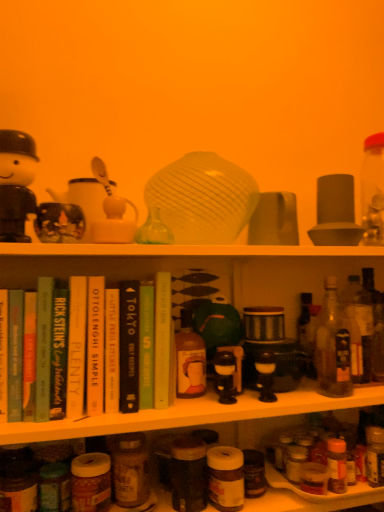
Question: Does translucent glass bottle at right, the third bottle in the left-to-right sequence, contain hardcover book at center, which is the 1th book in right-to-left order?

Choices:
 (A) yes
 (B) no

Answer: (B)

Question: Considering the relative positions of translucent glass bottle at right, the third bottle in the left-to-right sequence, and hardcover book at center, which is the 1th book in right-to-left order, in the image provided, is translucent glass bottle at right, the third bottle in the left-to-right sequence, behind hardcover book at center, which is the 1th book in right-to-left order,?

Choices:
 (A) yes
 (B) no

Answer: (A)

Question: From a real-world perspective, does translucent glass bottle at right, which is counted as the third bottle, starting from the right, stand above hardcover book at center, which is the 1th book in right-to-left order?

Choices:
 (A) no
 (B) yes

Answer: (A)

Question: Considering the relative sizes of translucent glass bottle at right, which is counted as the third bottle, starting from the right, and hardcover book at center, which is the 1th book in right-to-left order, in the image provided, is translucent glass bottle at right, which is counted as the third bottle, starting from the right, taller than hardcover book at center, which is the 1th book in right-to-left order,?

Choices:
 (A) yes
 (B) no

Answer: (A)

Question: Is the depth of translucent glass bottle at right, the third bottle in the left-to-right sequence, less than that of hardcover book at center, which is the 1th book in right-to-left order?

Choices:
 (A) yes
 (B) no

Answer: (B)

Question: From the image's perspective, would you say translucent glass bottle at right, the third bottle in the left-to-right sequence, is positioned over hardcover book at center, which is the 1th book in right-to-left order?

Choices:
 (A) no
 (B) yes

Answer: (A)

Question: From the image's perspective, does green matte book at center, which appears as the 2th book when viewed from the right, appear higher than hardcover book at center, placed as the 2th book when sorted from left to right?

Choices:
 (A) no
 (B) yes

Answer: (A)

Question: Considering the relative sizes of green matte book at center, which appears as the 2th book when viewed from the right, and hardcover book at center, acting as the 4th book starting from the right, in the image provided, is green matte book at center, which appears as the 2th book when viewed from the right, wider than hardcover book at center, acting as the 4th book starting from the right,?

Choices:
 (A) no
 (B) yes

Answer: (B)

Question: Is green matte book at center, which appears as the 2th book when viewed from the right, touching hardcover book at center, acting as the 4th book starting from the right?

Choices:
 (A) yes
 (B) no

Answer: (A)

Question: From a real-world perspective, does green matte book at center, which appears as the 2th book when viewed from the right, sit lower than hardcover book at center, placed as the 2th book when sorted from left to right?

Choices:
 (A) no
 (B) yes

Answer: (B)

Question: Can hardcover book at center, acting as the 4th book starting from the right, be found inside green matte book at center, which appears as the 2th book when viewed from the right?

Choices:
 (A) no
 (B) yes

Answer: (A)

Question: Does green matte book at center, which appears as the 2th book when viewed from the right, have a lesser width compared to hardcover book at center, acting as the 4th book starting from the right?

Choices:
 (A) no
 (B) yes

Answer: (A)

Question: Would you say matte brown bottle at lower center, positioned as the 5th bottle in right-to-left order, contains translucent glass bottle at right, which is counted as the third bottle, starting from the right?

Choices:
 (A) no
 (B) yes

Answer: (A)